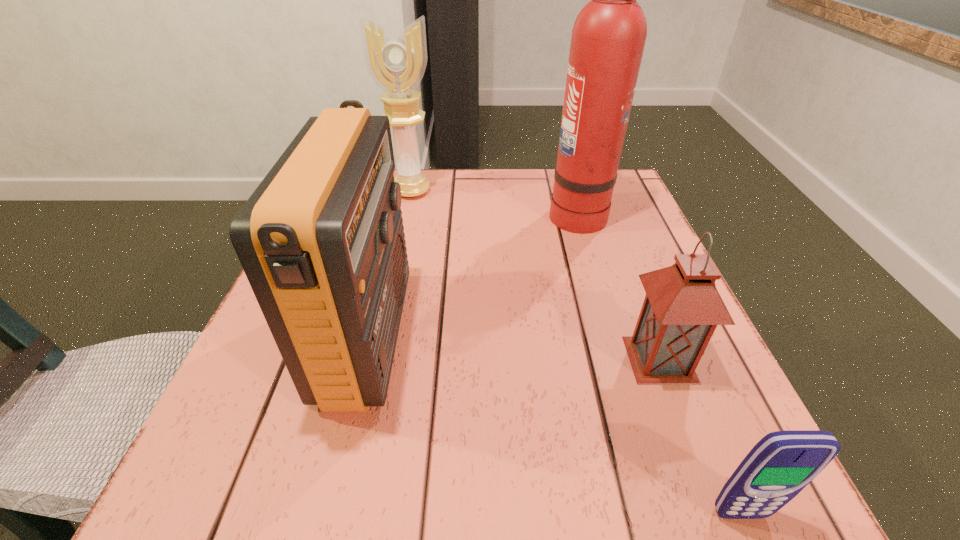
Image resolution: width=960 pixels, height=540 pixels. In order to click on object at the far left corner in this screenshot , I will do `click(396, 62)`.

This screenshot has width=960, height=540. I want to click on object present at the far right corner, so click(x=608, y=37).

I want to click on object that is at the near right corner, so tap(782, 463).

In order to click on vacant space at the far edge in this screenshot , I will do `click(422, 200)`.

Identify the location of vacant area at the near edge of the desktop. (557, 511).

You are a GUI agent. You are given a task and a screenshot of the screen. Output one action in this format:
    pyautogui.click(x=<x>, y=<y>)
    Task: Click on the vacant space at the right edge
    This screenshot has width=960, height=540.
    Given the screenshot: What is the action you would take?
    pyautogui.click(x=607, y=303)

The width and height of the screenshot is (960, 540). I want to click on vacant space at the far right corner of the desktop, so point(633,204).

The width and height of the screenshot is (960, 540). Find the location of `vacant area that lies between the award and the shortest object`. vacant area that lies between the award and the shortest object is located at coordinates (x=576, y=353).

Find the location of a particular element. The height and width of the screenshot is (540, 960). free space between the lantern and the nearest object is located at coordinates (700, 436).

At what (x,y) coordinates should I click in order to perform the action: click on free spot between the lantern and the shortest object. Please return your answer as a coordinate pair (x, y). Image resolution: width=960 pixels, height=540 pixels. Looking at the image, I should click on (700, 436).